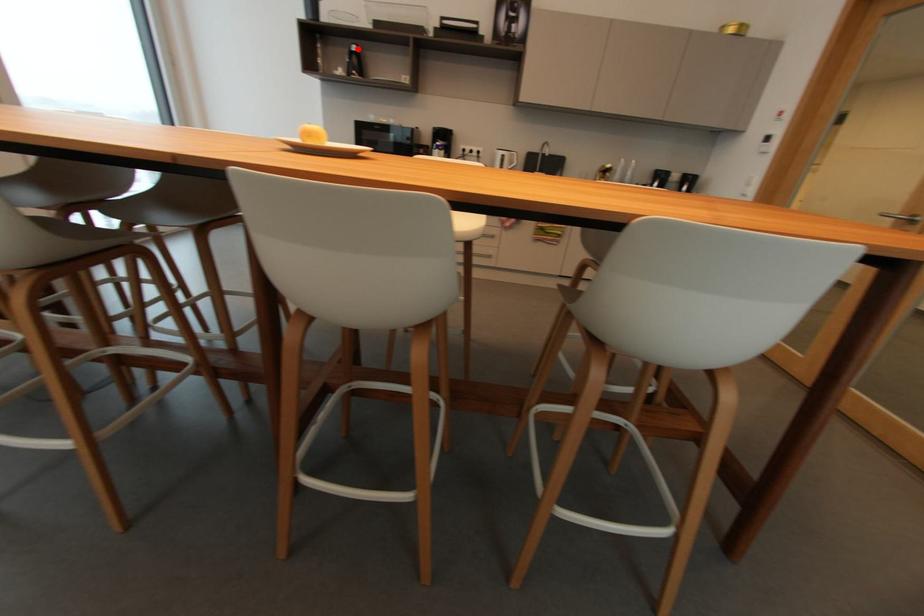
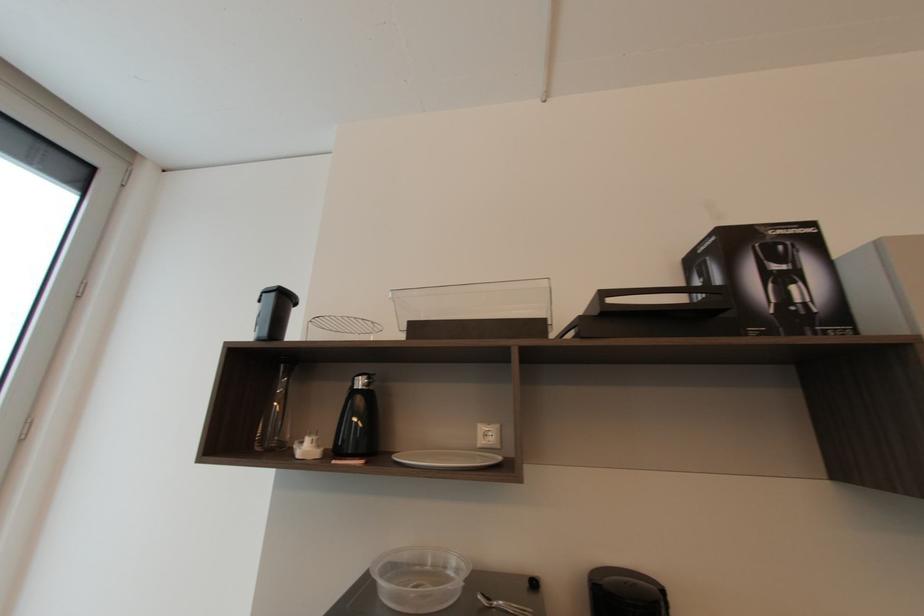
Find the pixel in the second image that matches the highlighted location in the first image.

(362, 384)